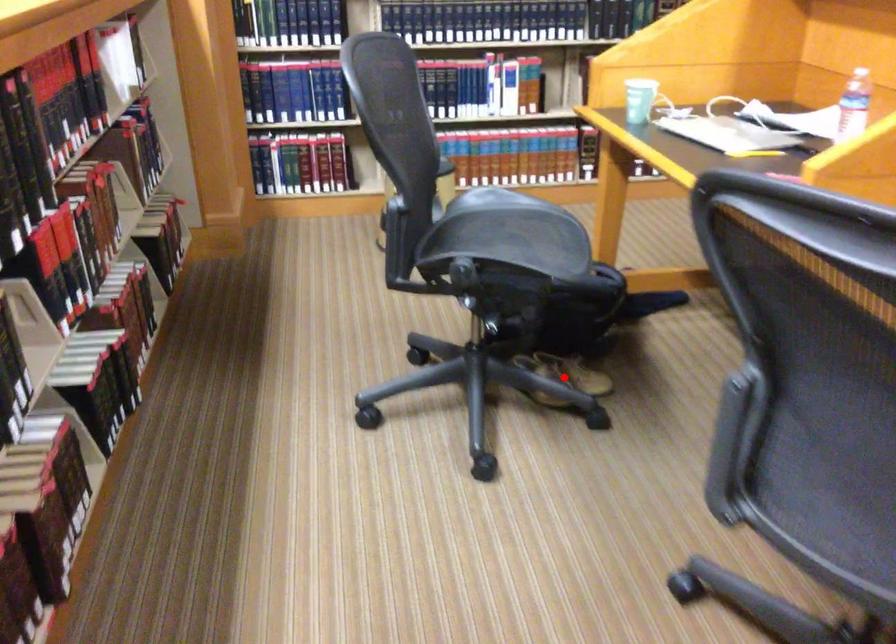
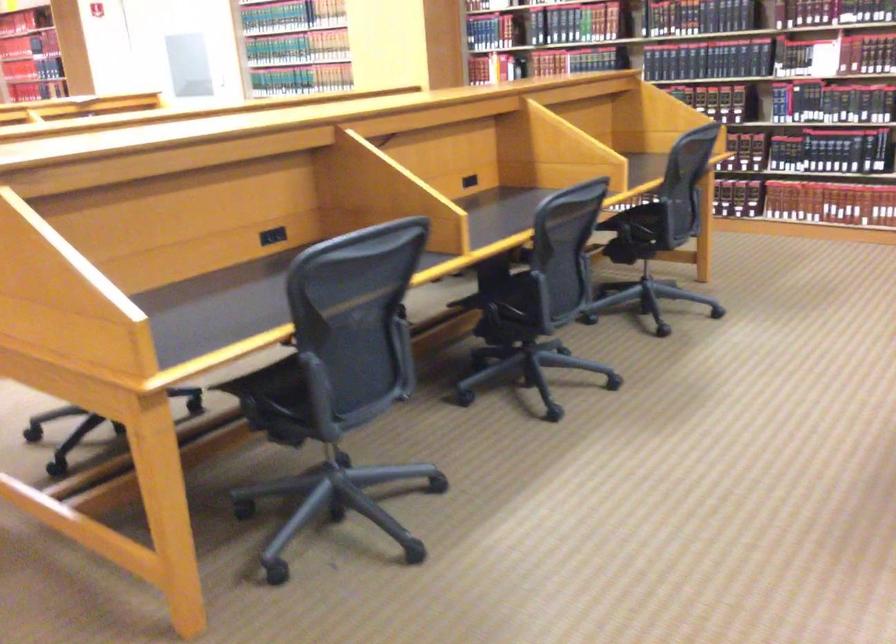
Question: I am providing you with two images of the same scene from different viewpoints. A red point is marked on the first image. At the location where the point appears in image 1, is it still visible in image 2?

Choices:
 (A) Yes
 (B) No

Answer: (B)